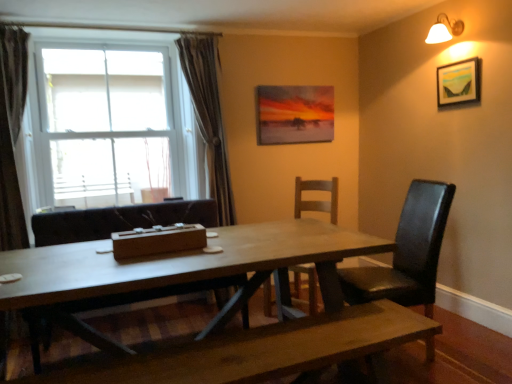
Where is `free space above matte canvas painting at upper center, which appears as the 1th picture frame when viewed from the left (from a real-world perspective)`? free space above matte canvas painting at upper center, which appears as the 1th picture frame when viewed from the left (from a real-world perspective) is located at coordinates (297, 86).